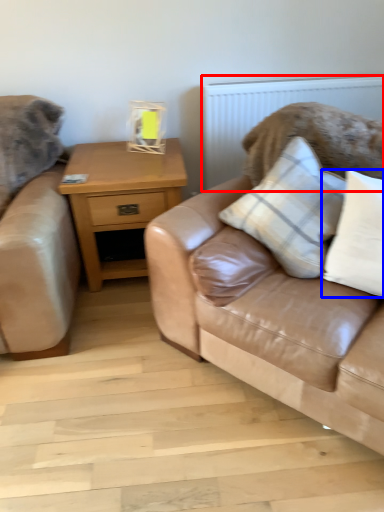
Question: Which object appears closest to the camera in this image, radiator (highlighted by a red box) or pillow (highlighted by a blue box)?

Choices:
 (A) radiator
 (B) pillow

Answer: (B)